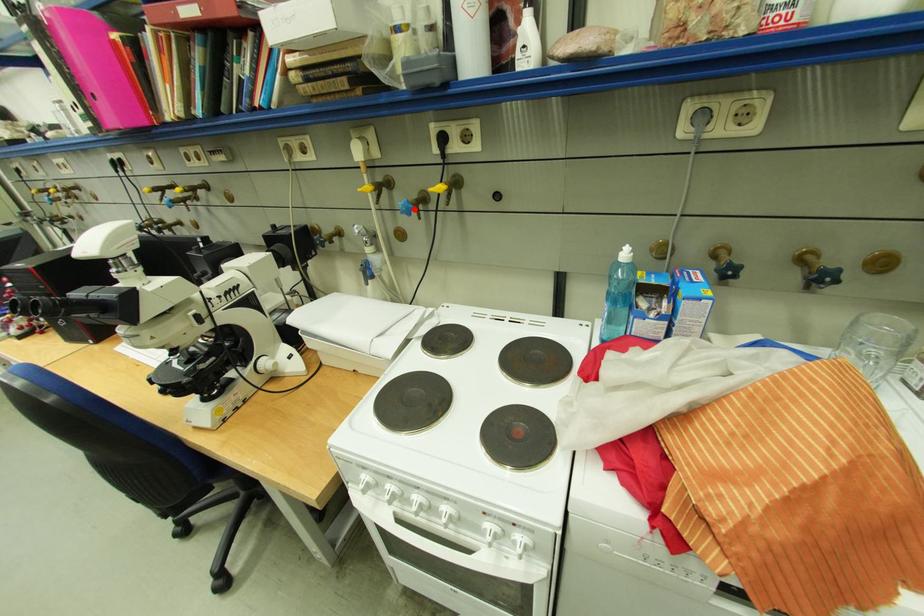
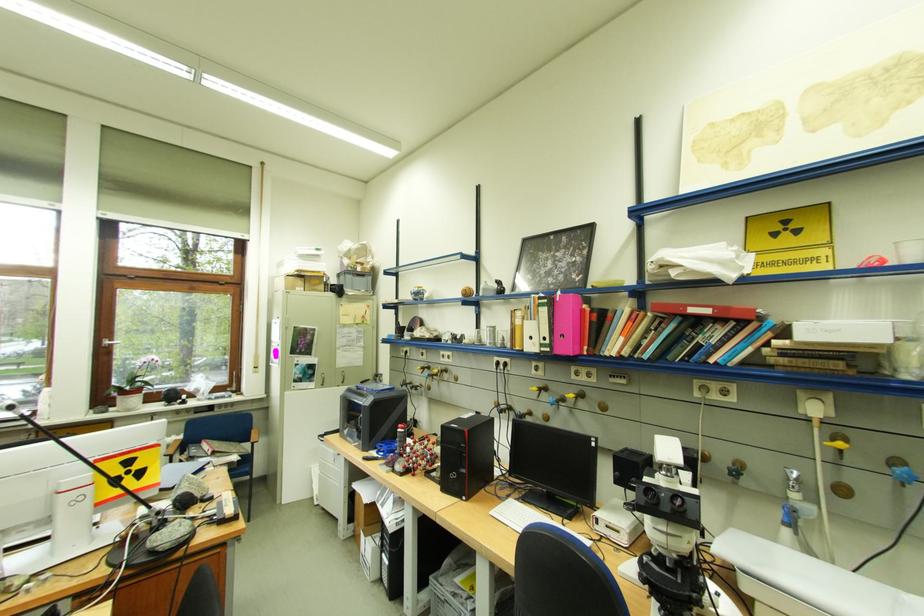
Question: I am providing you with two images of the same scene from different viewpoints. Image1 has a red point marked. In image2, the corresponding 3D location appears at what relative position? Reply with the corresponding letter.

Choices:
 (A) Closer
 (B) Farther

Answer: (A)